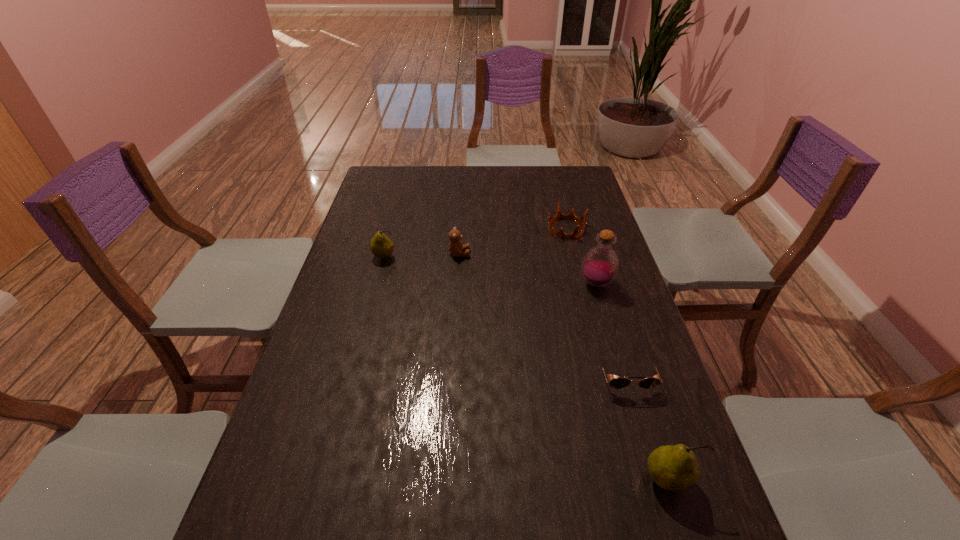
If we want them evenly spaced by inserting an extra pear among them, please locate a free spot for this new pear. Please provide its 2D coordinates. Your answer should be formatted as a tuple, i.e. [(x, y)], where the tuple contains the x and y coordinates of a point satisfying the conditions above.

[(492, 342)]